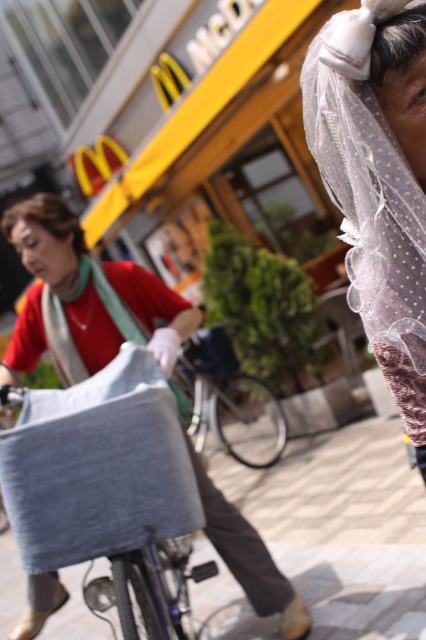
Question: Can you confirm if gray fabric bag at center is thinner than metallic silver bicycle at center?

Choices:
 (A) no
 (B) yes

Answer: (B)

Question: In this image, where is matte gray fabric bag at center located relative to metallic silver bicycle at center?

Choices:
 (A) right
 (B) left

Answer: (B)

Question: Which point is farther to the camera?

Choices:
 (A) metallic silver bicycle at center
 (B) gray fabric bag at center

Answer: (A)

Question: Which point appears closest to the camera in this image?

Choices:
 (A) (78, 481)
 (B) (69, 248)
 (C) (189, 371)

Answer: (A)

Question: Which of these objects is positioned farthest from the metallic silver bicycle at center?

Choices:
 (A) matte gray fabric bag at center
 (B) gray fabric bag at center

Answer: (B)

Question: Can you confirm if matte gray fabric bag at center is thinner than metallic silver bicycle at center?

Choices:
 (A) yes
 (B) no

Answer: (B)